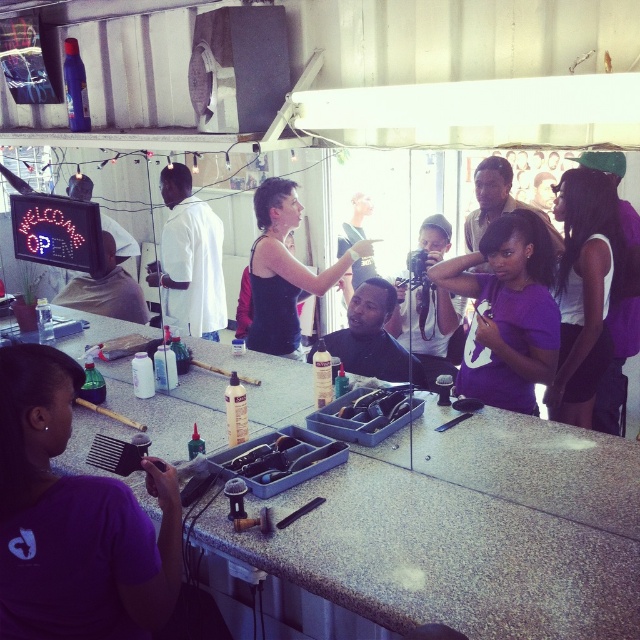
Which is more to the right, matte black hairbrush at center or short curly hair at center?

matte black hairbrush at center is more to the right.

Can you confirm if matte black hairbrush at center is positioned above short curly hair at center?

Actually, matte black hairbrush at center is below short curly hair at center.

Which is behind, point (497, 161) or point (490, 168)?

Point (497, 161)

Locate an element on the screen. The height and width of the screenshot is (640, 640). matte black hairbrush at center is located at coordinates (497, 202).

Can you confirm if purple matte comb at lower left is positioned to the left of short curly hair at center?

Yes, purple matte comb at lower left is to the left of short curly hair at center.

Can you confirm if purple matte comb at lower left is positioned below short curly hair at center?

Indeed, purple matte comb at lower left is positioned under short curly hair at center.

Who is more forward, (51, 570) or (506, 182)?

Point (51, 570) is in front.

The image size is (640, 640). I want to click on purple matte comb at lower left, so (72, 520).

Which is in front, point (284, 188) or point (509, 172)?

Point (284, 188) is more forward.

Does black matte tank top at center come behind short curly hair at center?

No, it is not.

Which is behind, point (339, 266) or point (508, 173)?

The point (508, 173) is behind.

I want to click on black matte tank top at center, so click(284, 269).